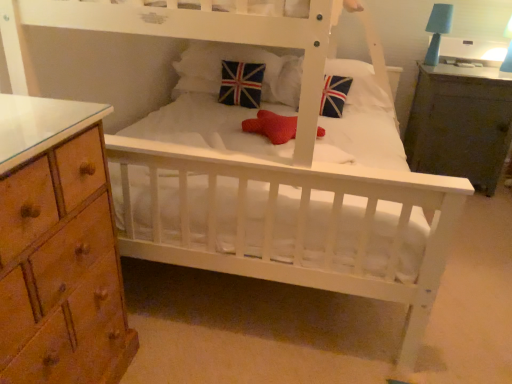
Identify the location of red mesh star at center. The height and width of the screenshot is (384, 512). (272, 126).

The image size is (512, 384). In order to click on dark wood nightstand at right in this screenshot , I will do `click(460, 124)`.

Identify the location of union jack fabric pillow at center, which is the first pillow from left to right. This screenshot has width=512, height=384. (238, 61).

Consider the image. Is velvet union jack pillow at center, the 2th pillow positioned from the left, positioned far away from red mesh star at center?

No, velvet union jack pillow at center, the 2th pillow positioned from the left, is in close proximity to red mesh star at center.

The image size is (512, 384). Find the location of `toy directly beneath the velvet union jack pillow at center, which is the 1th pillow from right to left (from a real-world perspective)`. toy directly beneath the velvet union jack pillow at center, which is the 1th pillow from right to left (from a real-world perspective) is located at coordinates (272, 126).

From a real-world perspective, which object rests below the other?

In real-world perspective, red mesh star at center is lower.

Which is behind, velvet union jack pillow at center, which is the 1th pillow from right to left, or dark wood nightstand at right?

dark wood nightstand at right.

Is velvet union jack pillow at center, which is the 1th pillow from right to left, taller than dark wood nightstand at right?

Incorrect, the height of velvet union jack pillow at center, which is the 1th pillow from right to left, is not larger of that of dark wood nightstand at right.

Which object is wider, velvet union jack pillow at center, which is the 1th pillow from right to left, or dark wood nightstand at right?

dark wood nightstand at right.

Is red mesh star at center facing towards union jack fabric pillow at center?

No, red mesh star at center is not turned towards union jack fabric pillow at center.

Considering the sizes of objects red mesh star at center and union jack fabric pillow at center in the image provided, who is smaller, red mesh star at center or union jack fabric pillow at center?

Smaller between the two is red mesh star at center.

Which is behind, point (293, 118) or point (236, 103)?

The point (236, 103) is farther.

Does union jack fabric pillow at center, the 2th pillow viewed from the right, lie behind velvet union jack pillow at center, the 2th pillow positioned from the left?

Yes, union jack fabric pillow at center, the 2th pillow viewed from the right, is further from the viewer.

Is union jack fabric pillow at center, the 2th pillow viewed from the right, surrounding velvet union jack pillow at center, the 2th pillow positioned from the left?

No, velvet union jack pillow at center, the 2th pillow positioned from the left, is not a part of union jack fabric pillow at center, the 2th pillow viewed from the right.

From the image's perspective, relative to velvet union jack pillow at center, which is the 1th pillow from right to left, is union jack fabric pillow at center, which is the first pillow from left to right, above or below?

From the image's perspective, union jack fabric pillow at center, which is the first pillow from left to right, appears above velvet union jack pillow at center, which is the 1th pillow from right to left.

The image size is (512, 384). I want to click on pillow on the right of union jack fabric pillow at center, the 2th pillow viewed from the right, so click(x=361, y=85).

Would you say dark wood nightstand at right is a long distance from velvet union jack pillow at center, which is the 1th pillow from right to left?

No, dark wood nightstand at right is not far away from velvet union jack pillow at center, which is the 1th pillow from right to left.

Considering the positions of objects dark wood nightstand at right and velvet union jack pillow at center, which is the 1th pillow from right to left, in the image provided, who is in front, dark wood nightstand at right or velvet union jack pillow at center, which is the 1th pillow from right to left,?

velvet union jack pillow at center, which is the 1th pillow from right to left, is closer to the camera.

Is point (478, 169) closer or farther from the camera than point (354, 70)?

Point (478, 169) is positioned farther from the camera compared to point (354, 70).

What are the coordinates of `the 1st pillow positioned above the dark wood nightstand at right (from a real-world perspective)` in the screenshot? It's located at (361, 85).

From a real-world perspective, is blue matte table lamp at upper right positioned above or below dark wood nightstand at right?

From a real-world perspective, blue matte table lamp at upper right is physically above dark wood nightstand at right.

Can you tell me how much blue matte table lamp at upper right and dark wood nightstand at right differ in facing direction?

0.49 degrees.

Considering the positions of objects blue matte table lamp at upper right and dark wood nightstand at right in the image provided, who is more to the left, blue matte table lamp at upper right or dark wood nightstand at right?

blue matte table lamp at upper right is more to the left.

Considering the sizes of objects blue matte table lamp at upper right and dark wood nightstand at right in the image provided, who is taller, blue matte table lamp at upper right or dark wood nightstand at right?

dark wood nightstand at right.

Considering the sizes of objects dark wood nightstand at right and red mesh star at center in the image provided, who is thinner, dark wood nightstand at right or red mesh star at center?

With smaller width is red mesh star at center.

How distant is dark wood nightstand at right from red mesh star at center?

3.64 feet.

Is dark wood nightstand at right taller or shorter than red mesh star at center?

Clearly, dark wood nightstand at right is taller compared to red mesh star at center.

Can you tell me how much dark wood nightstand at right and red mesh star at center differ in facing direction?

1.76 degrees.

What are the coordinates of `toy that is below the velvet union jack pillow at center, the 2th pillow positioned from the left (from the image's perspective)` in the screenshot? It's located at (272, 126).

Find the location of a particular element. This screenshot has height=384, width=512. nightstand on the right of velvet union jack pillow at center, which is the 1th pillow from right to left is located at coordinates (460, 124).

Based on their spatial positions, is union jack fabric pillow at center or dark wood nightstand at right further from velvet union jack pillow at center, the 2th pillow positioned from the left?

dark wood nightstand at right.

In the scene shown: Estimate the real-world distances between objects in this image. Which object is closer to union jack fabric pillow at center, union jack fabric pillow at center, which is the first pillow from left to right, or velvet union jack pillow at center, the 2th pillow positioned from the left?

Based on the image, union jack fabric pillow at center, which is the first pillow from left to right, appears to be nearer to union jack fabric pillow at center.

From the image, which object appears to be nearer to union jack fabric pillow at center, union jack fabric pillow at center, the 2th pillow viewed from the right, or red mesh star at center?

union jack fabric pillow at center, the 2th pillow viewed from the right, is closer to union jack fabric pillow at center.

Considering their positions, is union jack fabric pillow at center, which is the first pillow from left to right, positioned further to velvet union jack pillow at center, the 2th pillow positioned from the left, than blue matte table lamp at upper right?

blue matte table lamp at upper right.

Which object lies nearer to the anchor point blue matte table lamp at upper right, red mesh star at center or union jack fabric pillow at center?

union jack fabric pillow at center is closer to blue matte table lamp at upper right.

Looking at the image, which one is located closer to union jack fabric pillow at center, the 2th pillow viewed from the right, blue matte table lamp at upper right or velvet union jack pillow at center, which is the 1th pillow from right to left?

Based on the image, velvet union jack pillow at center, which is the 1th pillow from right to left, appears to be nearer to union jack fabric pillow at center, the 2th pillow viewed from the right.

Estimate the real-world distances between objects in this image. Which object is further from dark wood nightstand at right, red mesh star at center or union jack fabric pillow at center?

union jack fabric pillow at center is positioned further to the anchor dark wood nightstand at right.

From the image, which object appears to be farther from union jack fabric pillow at center, blue matte table lamp at upper right or red mesh star at center?

blue matte table lamp at upper right lies further to union jack fabric pillow at center than the other object.

The image size is (512, 384). In order to click on toy between union jack fabric pillow at center and dark wood nightstand at right in the horizontal direction in this screenshot , I will do `click(272, 126)`.

Identify the location of pillow located between union jack fabric pillow at center, the 2th pillow viewed from the right, and blue matte table lamp at upper right in the left-right direction. (361, 85).

You are a GUI agent. You are given a task and a screenshot of the screen. Output one action in this format:
    pyautogui.click(x=<x>, y=<y>)
    Task: Click on the table lamp between red mesh star at center and dark wood nightstand at right
    Image resolution: width=512 pixels, height=384 pixels.
    Given the screenshot: What is the action you would take?
    pyautogui.click(x=437, y=30)

Where is `table lamp between union jack fabric pillow at center and dark wood nightstand at right in the horizontal direction`? This screenshot has height=384, width=512. table lamp between union jack fabric pillow at center and dark wood nightstand at right in the horizontal direction is located at coordinates (437, 30).